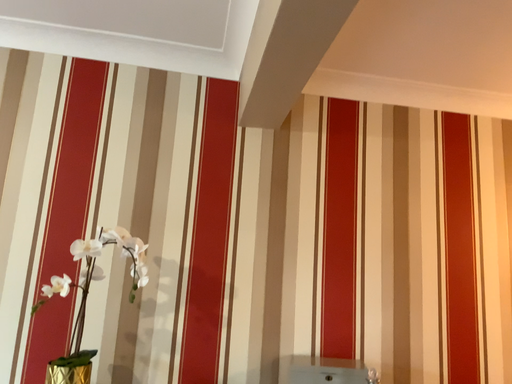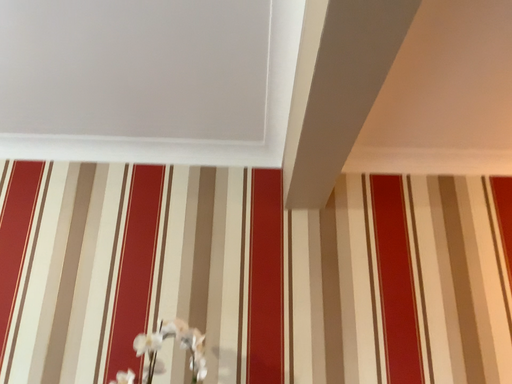
Question: How did the camera likely rotate when shooting the video?

Choices:
 (A) rotated downward
 (B) rotated upward

Answer: (B)